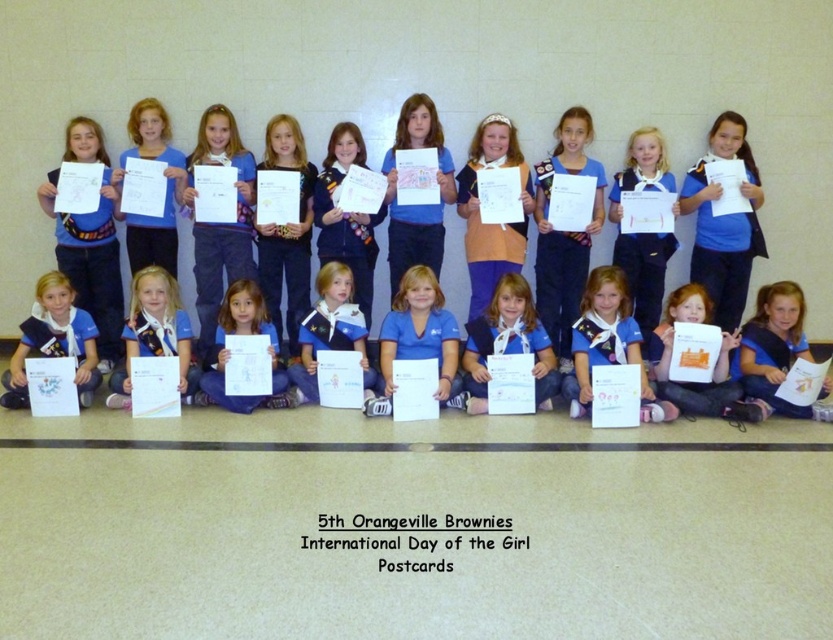
Question: Does blue fabric uniform at center appear over matte blue uniform at lower left?

Choices:
 (A) no
 (B) yes

Answer: (A)

Question: Does blue fabric uniform at center appear under matte blue uniform at lower left?

Choices:
 (A) yes
 (B) no

Answer: (A)

Question: Does blue fabric uniform at center have a greater width compared to matte blue uniform at lower left?

Choices:
 (A) no
 (B) yes

Answer: (B)